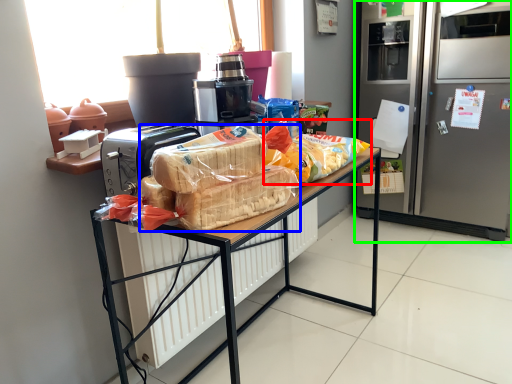
Question: Which is farther away from snack (highlighted by a red box)? snack (highlighted by a blue box) or refrigerator (highlighted by a green box)?

Choices:
 (A) snack
 (B) refrigerator

Answer: (B)